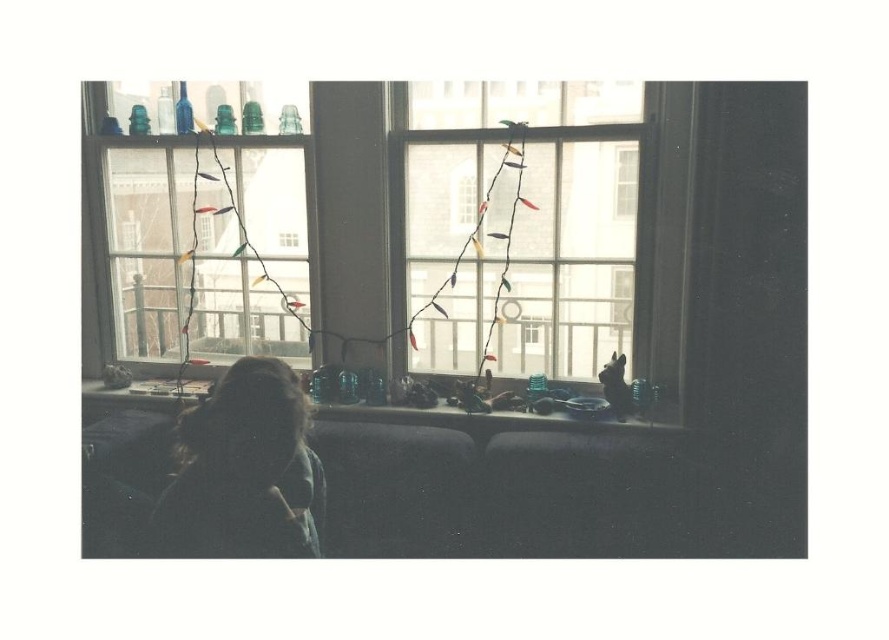
Question: Based on their relative distances, which object is farther from the translucent glass window at center?

Choices:
 (A) clear glass window at upper center
 (B) translucent glass objects at lower center

Answer: (A)

Question: Among these points, which one is nearest to the camera?

Choices:
 (A) (545, 260)
 (B) (315, 476)
 (C) (345, 413)
 (D) (303, 221)

Answer: (B)

Question: Estimate the real-world distances between objects in this image. Which object is farther from the transparent glass window at center?

Choices:
 (A) clear glass window at center
 (B) dark hair at lower left

Answer: (B)

Question: In this image, where is transparent glass window at center located relative to clear glass window at upper center?

Choices:
 (A) below
 (B) above

Answer: (A)

Question: Where is dark hair at lower left located in relation to translucent glass objects at lower center in the image?

Choices:
 (A) right
 (B) left

Answer: (B)

Question: Can you confirm if clear glass window at center is positioned below translucent glass window at center?

Choices:
 (A) no
 (B) yes

Answer: (A)